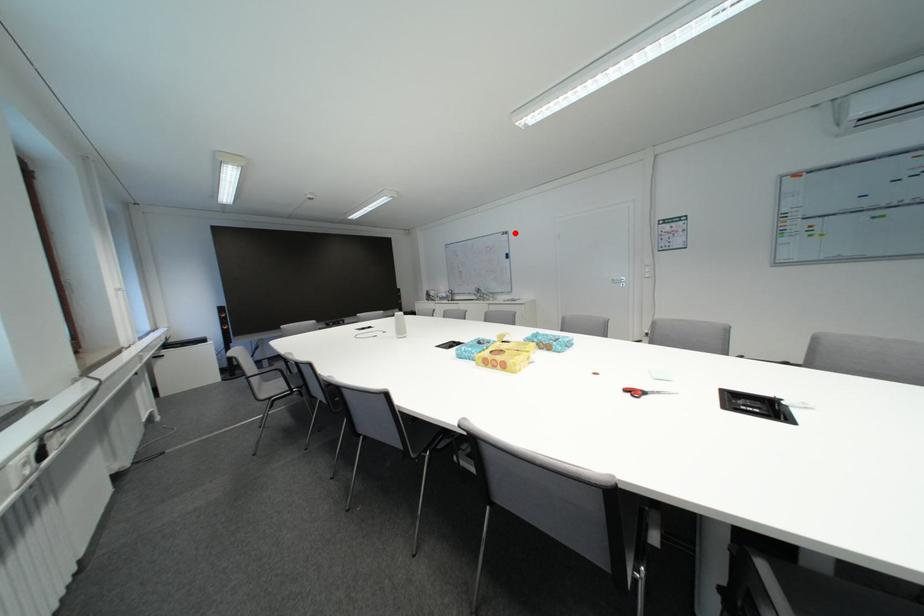
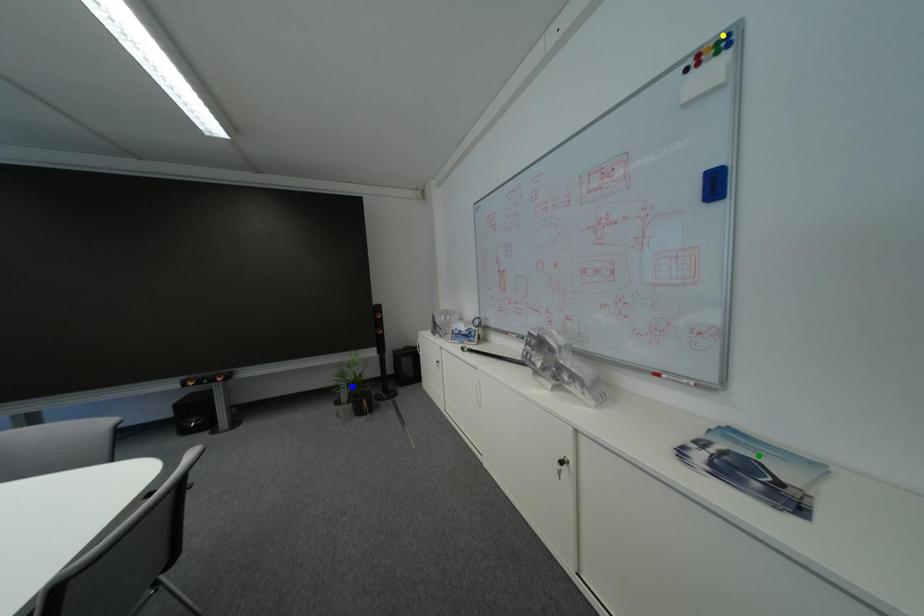
Question: I am providing you with two images of the same scene from different viewpoints. A red point is marked on the first image. You are given multiple points on the second image. In image 2, which mark is for the same physical point as the one in image 1?

Choices:
 (A) green point
 (B) blue point
 (C) yellow point

Answer: (C)